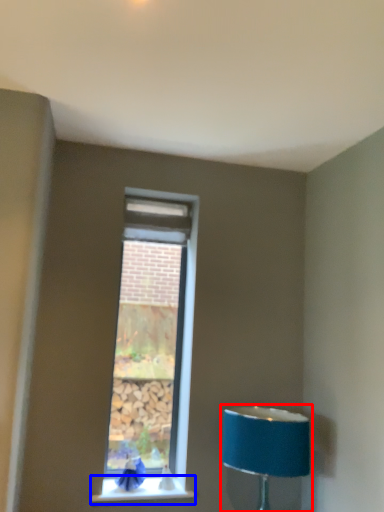
Question: Which of the following is the closest to the observer, lamp (highlighted by a red box) or window sill (highlighted by a blue box)?

Choices:
 (A) lamp
 (B) window sill

Answer: (A)